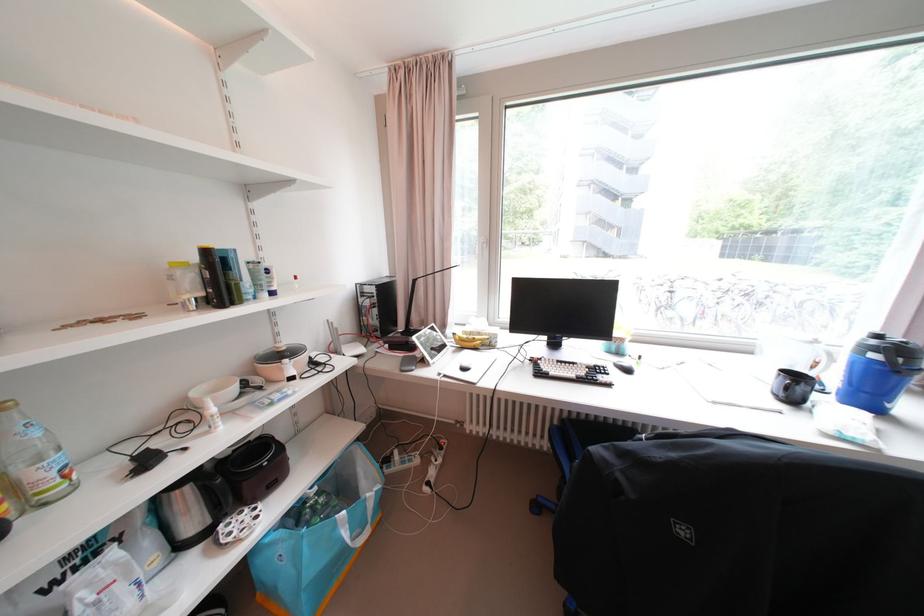
This screenshot has height=616, width=924. Describe the element at coordinates (891, 358) in the screenshot. I see `the blue shaker handle` at that location.